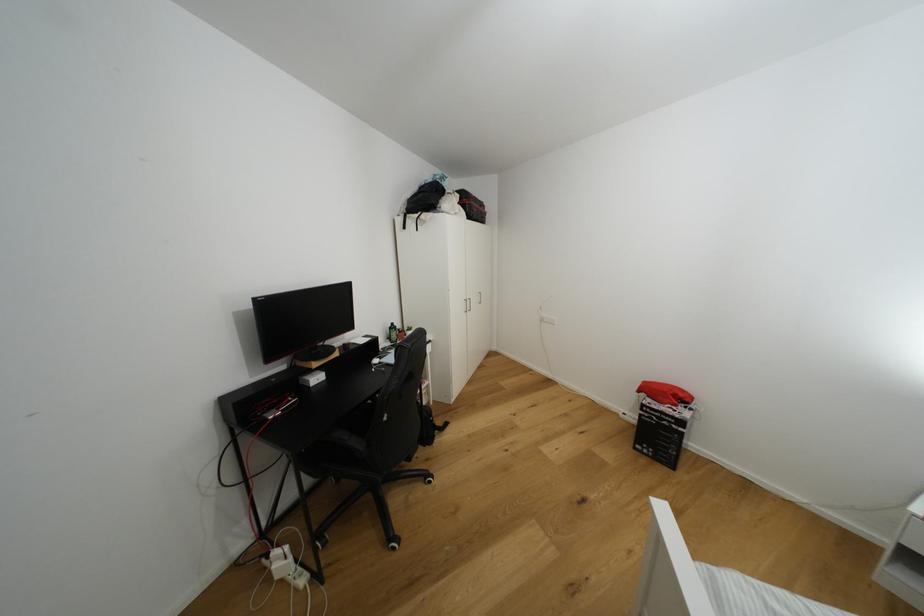
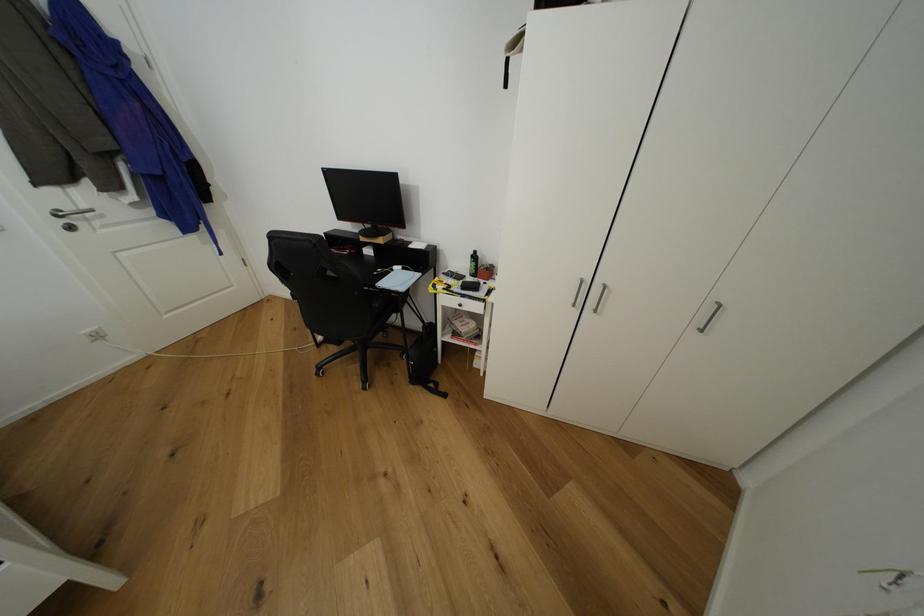
Locate, in the second image, the point that corresponds to (395,330) in the first image.

(478, 257)